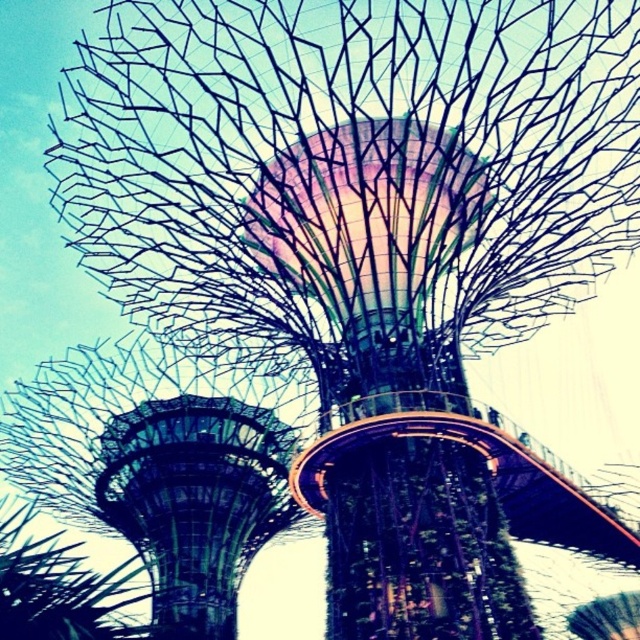
Question: Which point is closer to the camera?

Choices:
 (A) (24, 620)
 (B) (192, 525)

Answer: (A)

Question: Does green glass tower at lower left have a lesser width compared to metallic wireframe tree at lower left?

Choices:
 (A) yes
 (B) no

Answer: (A)

Question: Which point is closer to the camera?

Choices:
 (A) (198, 484)
 (B) (124, 570)

Answer: (A)

Question: Can you confirm if green glass tower at lower left is wider than metallic wireframe tree at lower left?

Choices:
 (A) no
 (B) yes

Answer: (A)

Question: Does green glass tower at lower left lie in front of metallic wireframe tree at lower left?

Choices:
 (A) yes
 (B) no

Answer: (B)